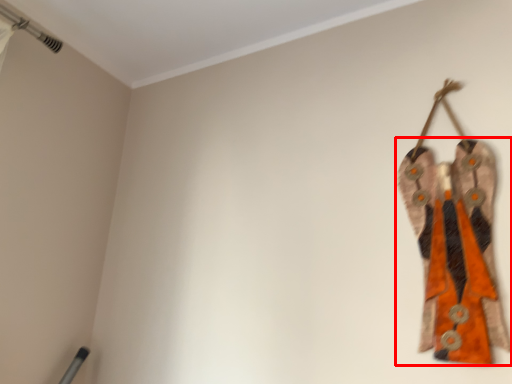
Question: From the image's perspective, considering the relative positions of fancy dress (annotated by the red box) and trim in the image provided, where is fancy dress (annotated by the red box) located with respect to the staircase?

Choices:
 (A) above
 (B) below

Answer: (B)